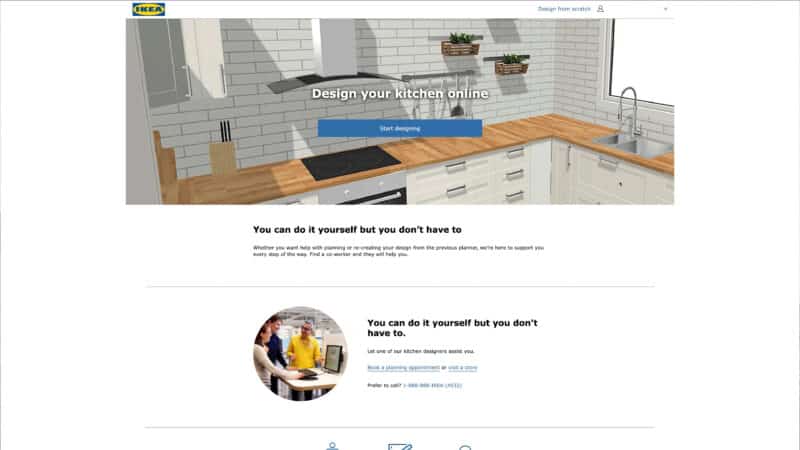
Locate an element on the screen. stove vent is located at coordinates tap(344, 78).